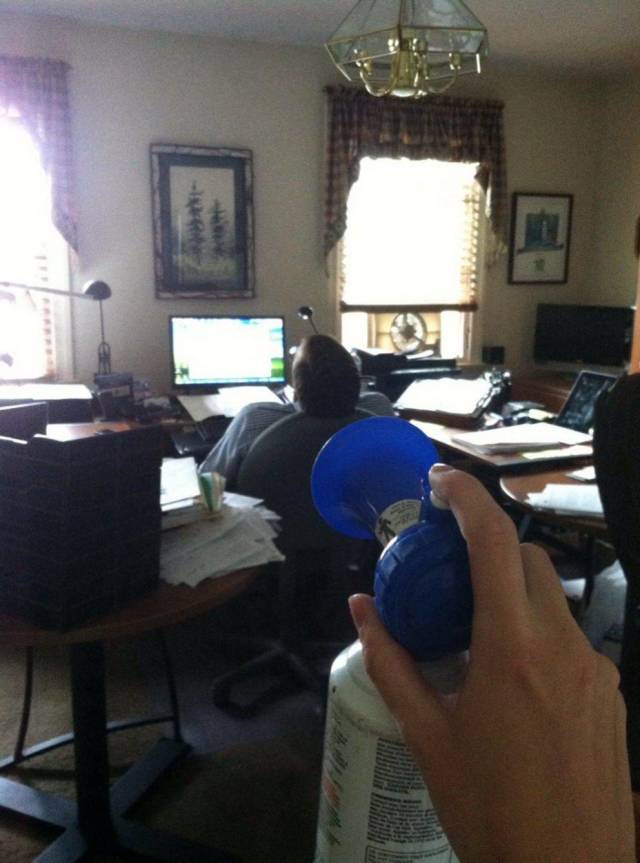
Find the location of a particular element. windows is located at coordinates (397, 234), (17, 240).